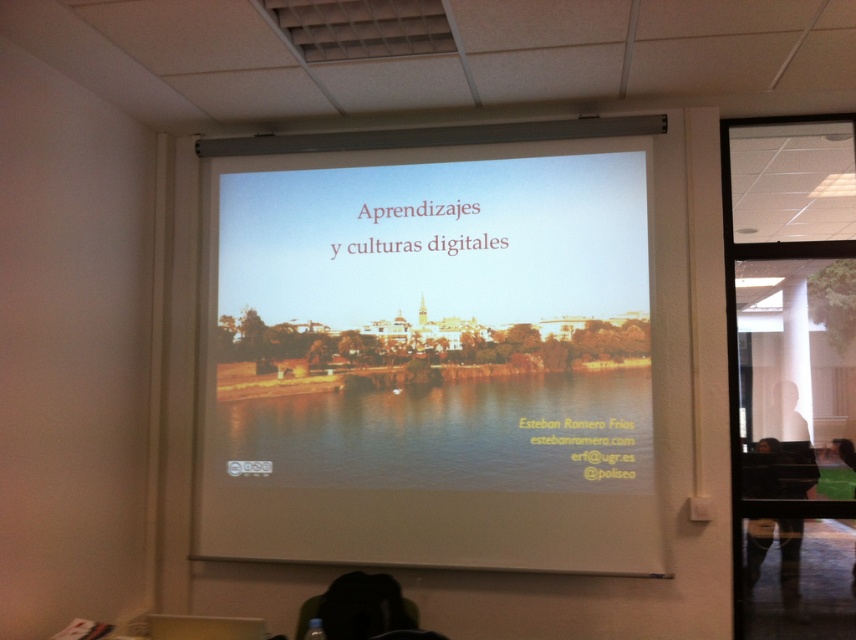
Who is more distant from viewer, (x=623, y=349) or (x=746, y=545)?

The point (x=746, y=545) is more distant.

Between white glossy projector screen at center and dark hair at lower right, which one is positioned lower?

dark hair at lower right is lower down.

Is point (598, 412) positioned in front of point (749, 554)?

Yes, point (598, 412) is closer to viewer.

Locate an element on the screen. This screenshot has height=640, width=856. white glossy projector screen at center is located at coordinates (431, 356).